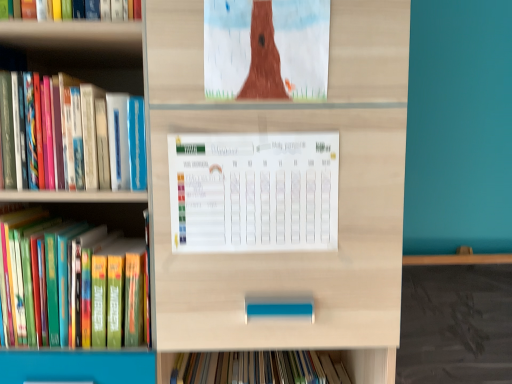
Question: Are matte brown tree at upper center and white paper calendar at center making contact?

Choices:
 (A) yes
 (B) no

Answer: (B)

Question: Does matte brown tree at upper center lie behind white paper calendar at center?

Choices:
 (A) yes
 (B) no

Answer: (B)

Question: Can you confirm if matte brown tree at upper center is bigger than white paper calendar at center?

Choices:
 (A) no
 (B) yes

Answer: (A)

Question: From the image's perspective, is matte brown tree at upper center on top of white paper calendar at center?

Choices:
 (A) yes
 (B) no

Answer: (A)

Question: From the image's perspective, is matte brown tree at upper center under white paper calendar at center?

Choices:
 (A) no
 (B) yes

Answer: (A)

Question: From the image's perspective, is hardcover book at left, marked as the 1th book in a bottom-to-top arrangement, above or below hardcover book at left, placed as the second book when sorted from bottom to top?

Choices:
 (A) above
 (B) below

Answer: (B)

Question: Looking at the image, does hardcover book at left, marked as the 1th book in a bottom-to-top arrangement, seem bigger or smaller compared to hardcover book at left, the 1th book viewed from the top?

Choices:
 (A) small
 (B) big

Answer: (A)

Question: Considering the positions of hardcover book at left, marked as the 1th book in a bottom-to-top arrangement, and hardcover book at left, the 1th book viewed from the top, in the image, is hardcover book at left, marked as the 1th book in a bottom-to-top arrangement, wider or thinner than hardcover book at left, the 1th book viewed from the top,?

Choices:
 (A) thin
 (B) wide

Answer: (B)

Question: From a real-world perspective, relative to hardcover book at left, the 1th book viewed from the top, is hardcover book at left, which appears as the second book when viewed from the top, vertically above or below?

Choices:
 (A) below
 (B) above

Answer: (A)

Question: In terms of size, does hardcover book at left, the 1th book viewed from the top, appear bigger or smaller than matte brown tree at upper center?

Choices:
 (A) small
 (B) big

Answer: (B)

Question: Is point (91, 107) positioned closer to the camera than point (320, 74)?

Choices:
 (A) farther
 (B) closer

Answer: (A)

Question: From a real-world perspective, is hardcover book at left, placed as the second book when sorted from bottom to top, physically located above or below matte brown tree at upper center?

Choices:
 (A) below
 (B) above

Answer: (A)

Question: Do you think hardcover book at left, placed as the second book when sorted from bottom to top, is within matte brown tree at upper center, or outside of it?

Choices:
 (A) outside
 (B) inside

Answer: (A)

Question: From the image's perspective, is hardcover book at left, marked as the 1th book in a bottom-to-top arrangement, above or below matte brown tree at upper center?

Choices:
 (A) above
 (B) below

Answer: (B)

Question: Is hardcover book at left, which appears as the second book when viewed from the top, inside the boundaries of matte brown tree at upper center, or outside?

Choices:
 (A) inside
 (B) outside

Answer: (B)